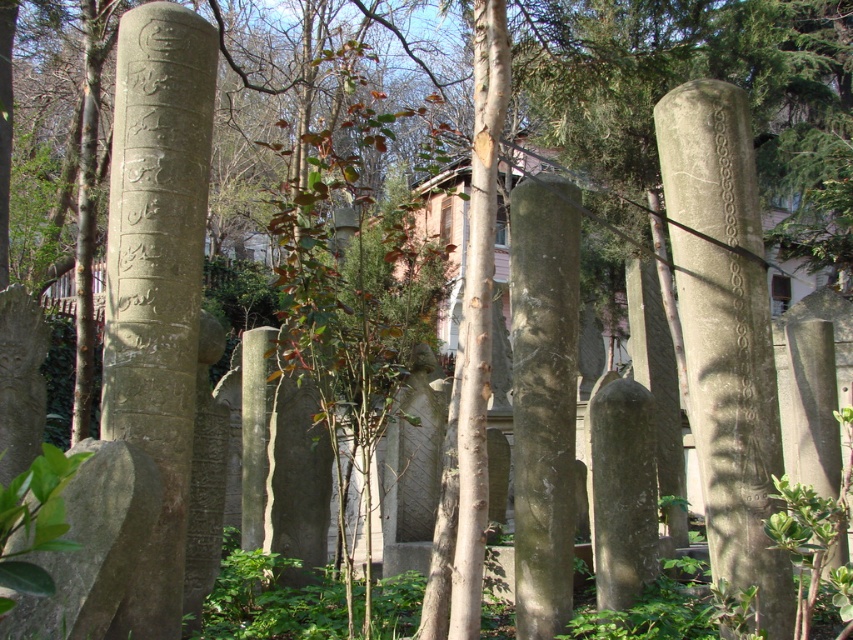
You are standing at the entrance of the cemetery and see two points marked in the scene. The first point is labeled as point (744, 269) and the second is point (463, 570). Which point is closer to you?

Point (463, 570) is closer to you because point (744, 269) is behind it.

You are standing at the entrance of the cemetery and want to locate the green mossy stone pillar at center. According to the map coordinates, where would you find it?

The green mossy stone pillar at center is located at coordinates point (543, 397).

You are a gardener planning to trim the green mossy stone pillar at center and the smooth brown tree trunk at center. Which one requires a ladder to reach the top?

The green mossy stone pillar at center is taller than the smooth brown tree trunk at center, so you will need a ladder to reach the top of the green mossy stone pillar at center.